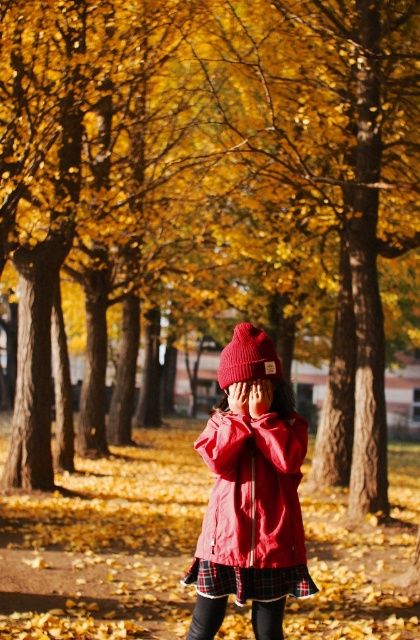
You are standing in the autumn park scene and notice the matte red jacket at center. Can you determine its exact location based on the coordinates provided?

The matte red jacket at center is located at point (252, 490).